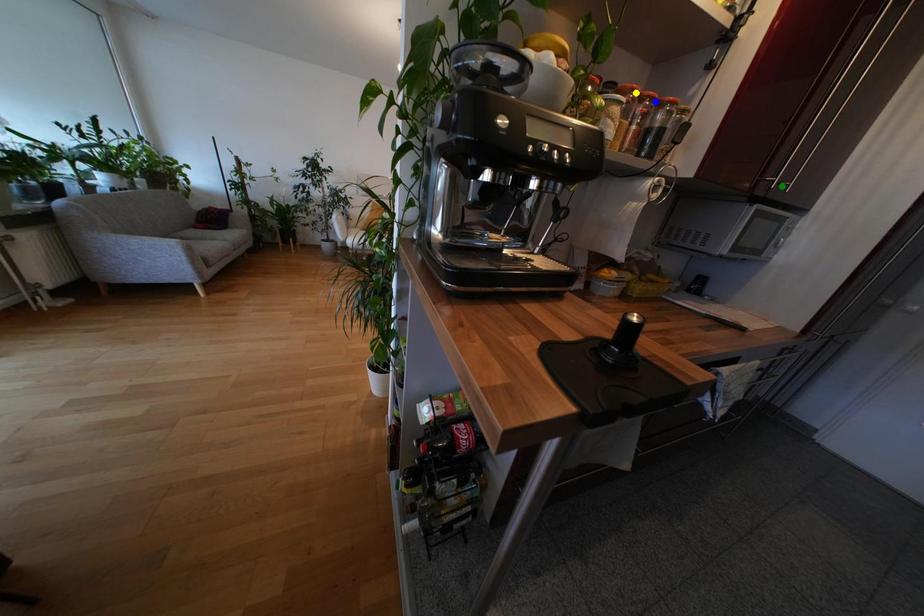
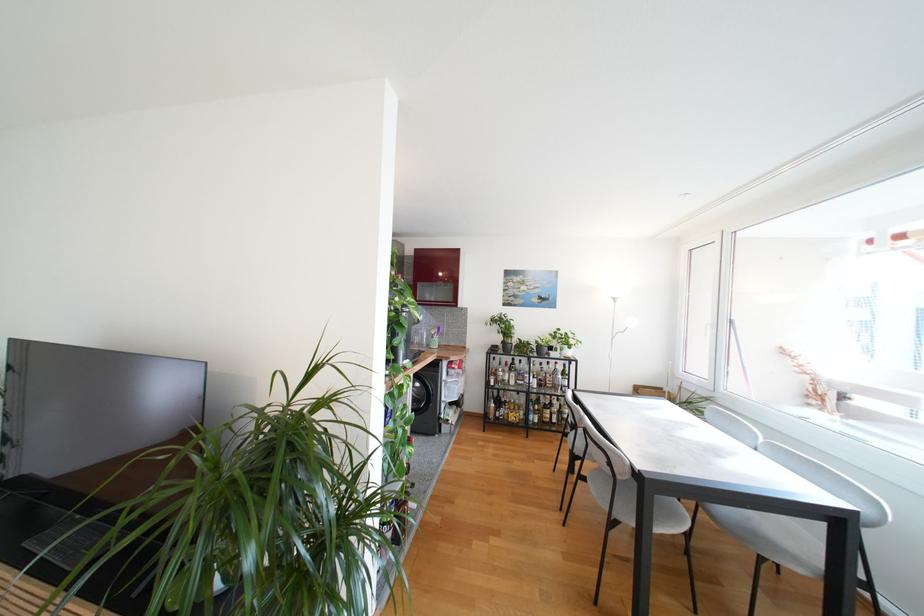
I am providing you with two images of the same scene from different viewpoints. Three points are marked in image1. Which point corresponds to a part or object that is occluded in image2?In image1, three points are marked. Which of them correspond to a part or object that is occluded in image2?Among the three points shown in image1, which one corresponds to a part or object that is no longer visible due to occlusion in image2?

Invisible in image2: blue point, yellow point, green point.